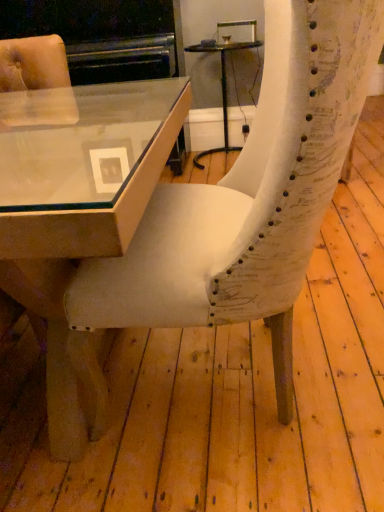
Question: Can you confirm if matte glass table at center, which appears as the second table when viewed from the top, is smaller than matte glass table at center, the second table in the front-to-back sequence?

Choices:
 (A) no
 (B) yes

Answer: (A)

Question: Is matte glass table at center, acting as the first table starting from the left, oriented towards matte glass table at center, the first table when ordered from right to left?

Choices:
 (A) yes
 (B) no

Answer: (B)

Question: Is matte glass table at center, acting as the first table starting from the left, at the left side of matte glass table at center, which is the 2th table in left-to-right order?

Choices:
 (A) no
 (B) yes

Answer: (B)

Question: Is matte glass table at center, which is the first table in front-to-back order, bigger than matte glass table at center, the second table in the front-to-back sequence?

Choices:
 (A) no
 (B) yes

Answer: (B)

Question: Is matte glass table at center, which is the first table in front-to-back order, wider than matte glass table at center, arranged as the 1th table when viewed from the back?

Choices:
 (A) yes
 (B) no

Answer: (A)

Question: From a real-world perspective, is white textured chair at center above or below matte glass table at center, which is the first table in front-to-back order?

Choices:
 (A) below
 (B) above

Answer: (B)

Question: In terms of size, does white textured chair at center appear bigger or smaller than matte glass table at center, which appears as the second table when viewed from the top?

Choices:
 (A) big
 (B) small

Answer: (B)

Question: Is white textured chair at center taller or shorter than matte glass table at center, the 1th table ordered from the bottom?

Choices:
 (A) tall
 (B) short

Answer: (A)

Question: Considering the relative positions of white textured chair at center and matte glass table at center, acting as the first table starting from the left, in the image provided, is white textured chair at center to the left or to the right of matte glass table at center, acting as the first table starting from the left,?

Choices:
 (A) left
 (B) right

Answer: (B)

Question: Is matte glass table at center, which appears as the second table when viewed from the top, wider or thinner than white textured chair at center?

Choices:
 (A) thin
 (B) wide

Answer: (B)

Question: From a real-world perspective, is matte glass table at center, which is counted as the second table, starting from the back, positioned above or below white textured chair at center?

Choices:
 (A) below
 (B) above

Answer: (A)

Question: In the image, is matte glass table at center, the 1th table ordered from the bottom, positioned in front of or behind white textured chair at center?

Choices:
 (A) behind
 (B) front

Answer: (B)

Question: From the image's perspective, is matte glass table at center, placed as the second table when sorted from right to left, above or below white textured chair at center?

Choices:
 (A) above
 (B) below

Answer: (B)

Question: Considering the positions of white textured chair at center and matte glass table at center, arranged as the 1th table when viewed from the back, in the image, is white textured chair at center taller or shorter than matte glass table at center, arranged as the 1th table when viewed from the back,?

Choices:
 (A) short
 (B) tall

Answer: (B)

Question: Visually, is white textured chair at center positioned to the left or to the right of matte glass table at center, the 2th table in the bottom-to-top sequence?

Choices:
 (A) right
 (B) left

Answer: (B)